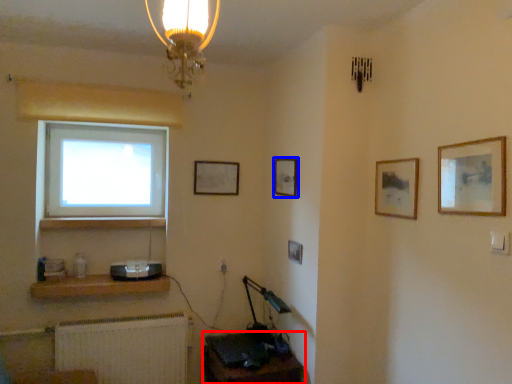
Question: Which object is further to the camera taking this photo, computer desk (highlighted by a red box) or picture frame (highlighted by a blue box)?

Choices:
 (A) computer desk
 (B) picture frame

Answer: (B)